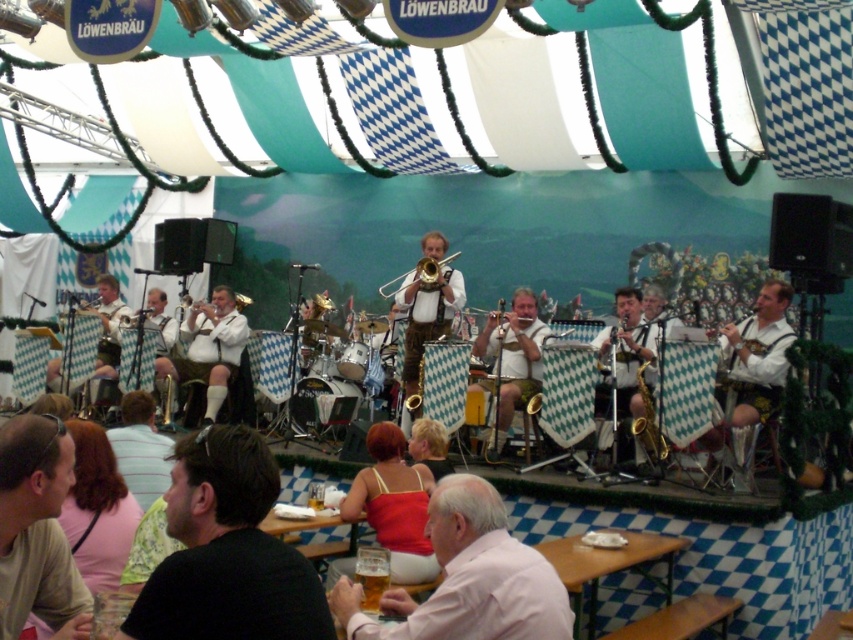
You are standing at the entrance of the beer tent and want to take a photo of both the band and the seated patrons. You have two points marked on your camera screen to ensure both subjects are in frame. The first point is at coordinate point (436, 307) and the second is at point (618, 355). Which point should you focus on first to capture both subjects clearly?

You should focus on point (436, 307) first because it is closer to you than point (618, 355), ensuring both subjects are in focus when adjusting the camera.

You are a photographer standing at the entrance of the beer tent. You want to take a photo of both the white leather shirt at right and the white leather jacket at center in the same frame. The camera you are using has a maximum focus range of 8 meters. Will you be able to capture both objects in focus without moving closer?

The distance between the white leather shirt at right and the white leather jacket at center is 7.60 meters. Since the camera can focus up to 8 meters, you can capture both objects in focus without moving closer.

You are a photographer at the Oktoberfest beer tent and want to take a photo of the light blue shirt at lower left and the white leather jacket at center. Which of the two items should you adjust the camera focus to capture clearly if the depth of field can only accommodate one object at a time based on their height?

The light blue shirt at lower left is shorter than the white leather jacket at center. Since depth of field prioritizes objects at similar distances, you should focus on the white leather jacket at center as it is taller and likely closer to the camera.